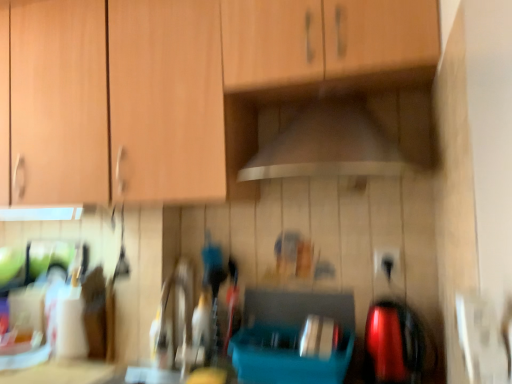
Question: From a real-world perspective, does black plastic electric outlet at lower right sit lower than wooden cabinet at upper center?

Choices:
 (A) yes
 (B) no

Answer: (A)

Question: Considering the relative sizes of black plastic electric outlet at lower right and wooden cabinet at upper center in the image provided, is black plastic electric outlet at lower right smaller than wooden cabinet at upper center?

Choices:
 (A) yes
 (B) no

Answer: (A)

Question: Can you confirm if black plastic electric outlet at lower right is taller than wooden cabinet at upper center?

Choices:
 (A) no
 (B) yes

Answer: (A)

Question: Does black plastic electric outlet at lower right appear on the left side of wooden cabinet at upper center?

Choices:
 (A) no
 (B) yes

Answer: (A)

Question: From the image's perspective, is black plastic electric outlet at lower right under wooden cabinet at upper center?

Choices:
 (A) no
 (B) yes

Answer: (B)

Question: Is black plastic electric outlet at lower right bigger than wooden cabinet at upper center?

Choices:
 (A) no
 (B) yes

Answer: (A)

Question: Can you confirm if wooden cabinet at upper center is thinner than black plastic electric outlet at lower right?

Choices:
 (A) yes
 (B) no

Answer: (B)

Question: Can you confirm if wooden cabinet at upper center is wider than black plastic electric outlet at lower right?

Choices:
 (A) yes
 (B) no

Answer: (A)

Question: Is wooden cabinet at upper center taller than black plastic electric outlet at lower right?

Choices:
 (A) yes
 (B) no

Answer: (A)

Question: Does wooden cabinet at upper center turn towards black plastic electric outlet at lower right?

Choices:
 (A) yes
 (B) no

Answer: (B)

Question: Is wooden cabinet at upper center at the left side of black plastic electric outlet at lower right?

Choices:
 (A) yes
 (B) no

Answer: (A)

Question: Is the position of wooden cabinet at upper center less distant than that of black plastic electric outlet at lower right?

Choices:
 (A) no
 (B) yes

Answer: (B)

Question: Would you say wooden cabinet at upper center is part of white glossy countertop at lower left's contents?

Choices:
 (A) yes
 (B) no

Answer: (B)